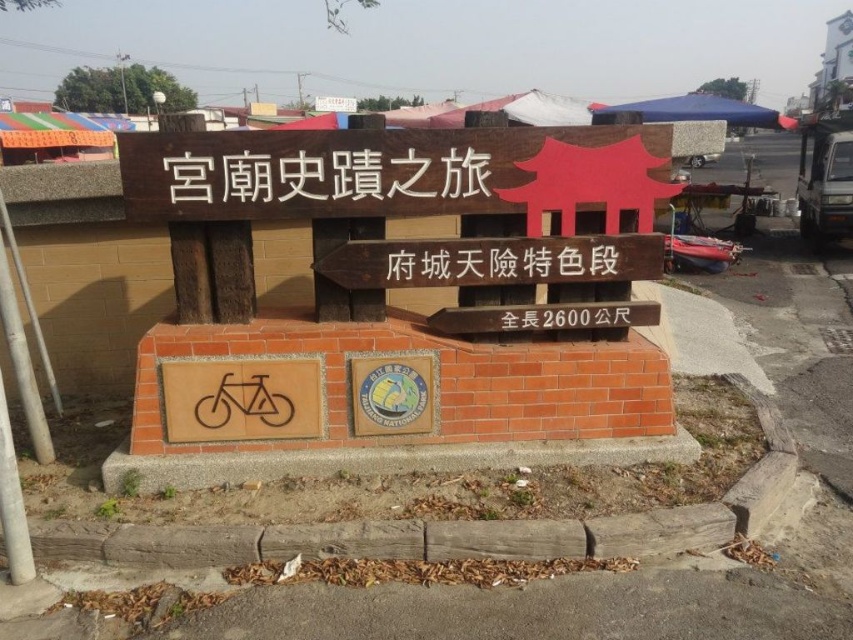
You are designing a new sign for the Palace Temple Historical Journey route. The existing sign has a wooden signboard at center and a black plastic text at center. Which object has a greater width according to the description?

The black plastic text at center has a greater width than the wooden signboard at center.

You are a tourist holding a map that says the next landmark is 300 meters away. You see the black wood sign at center and the wooden signboard at center. Which one should you look at to find the total length of the route?

The black wood sign at center mentions the total length of 2600 meters, so you should look at the black wood sign at center to find the total length of the route.

You are a tourist standing in front of the signboard and want to take a photo that includes both the brown wooden sign at center and the wooden signboard at center. Which one will appear taller in your photo?

The wooden signboard at center will appear taller in the photo because it is taller than the brown wooden sign at center.